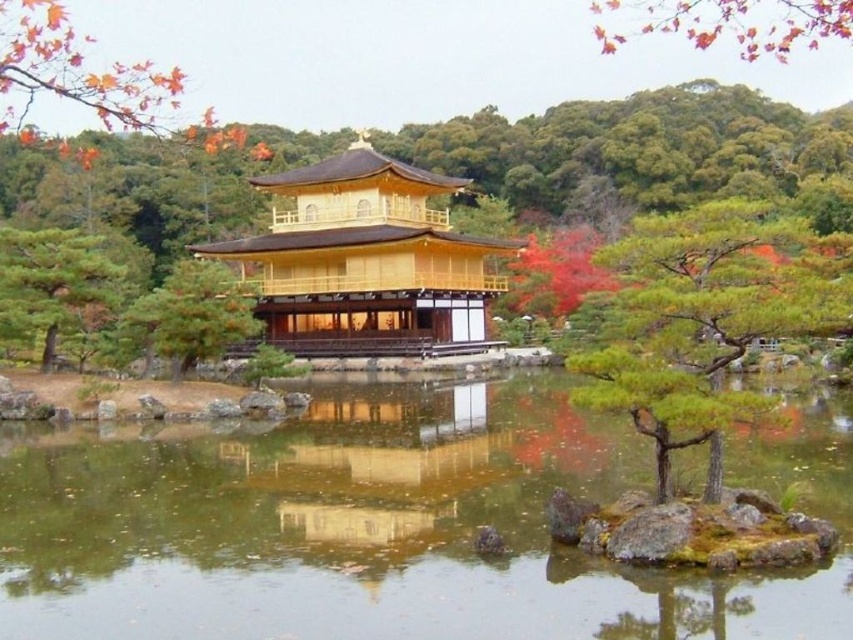
Question: From the image, what is the correct spatial relationship of golden polished wood temple at center in relation to green textured pine tree at center-left?

Choices:
 (A) below
 (B) above

Answer: (B)

Question: Does green textured pine tree at center have a greater width compared to green textured pine tree at center-left?

Choices:
 (A) no
 (B) yes

Answer: (B)

Question: Which point is closer to the camera?

Choices:
 (A) (448, 250)
 (B) (840, 4)

Answer: (B)

Question: Is clear water at center thinner than green textured pine tree at center-left?

Choices:
 (A) yes
 (B) no

Answer: (B)

Question: Which of the following is the farthest from the observer?

Choices:
 (A) (500, 612)
 (B) (809, 8)

Answer: (B)

Question: Which is farther from the green textured pine tree at center?

Choices:
 (A) autumn leaves at upper right
 (B) green textured pine tree at center-left
 (C) green textured tree at center

Answer: (A)